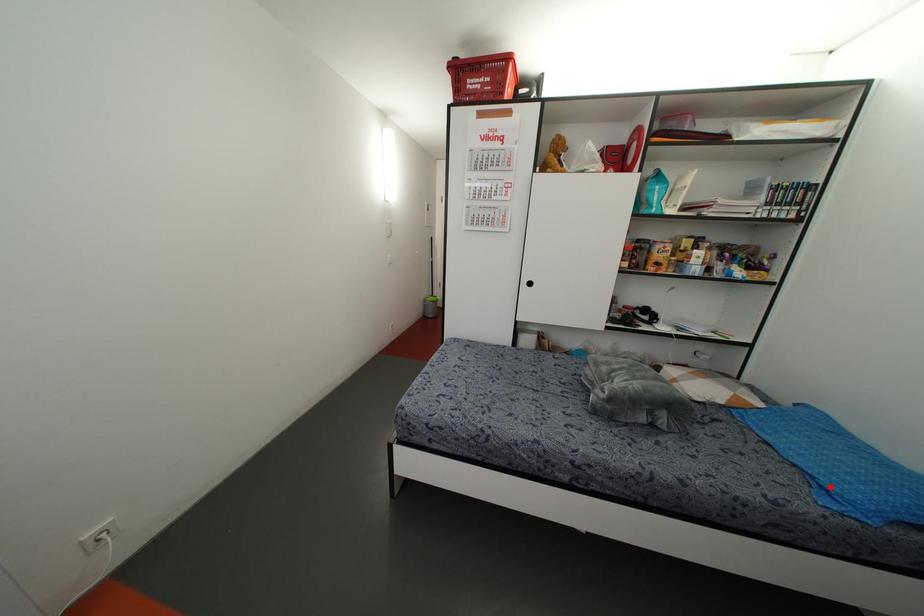
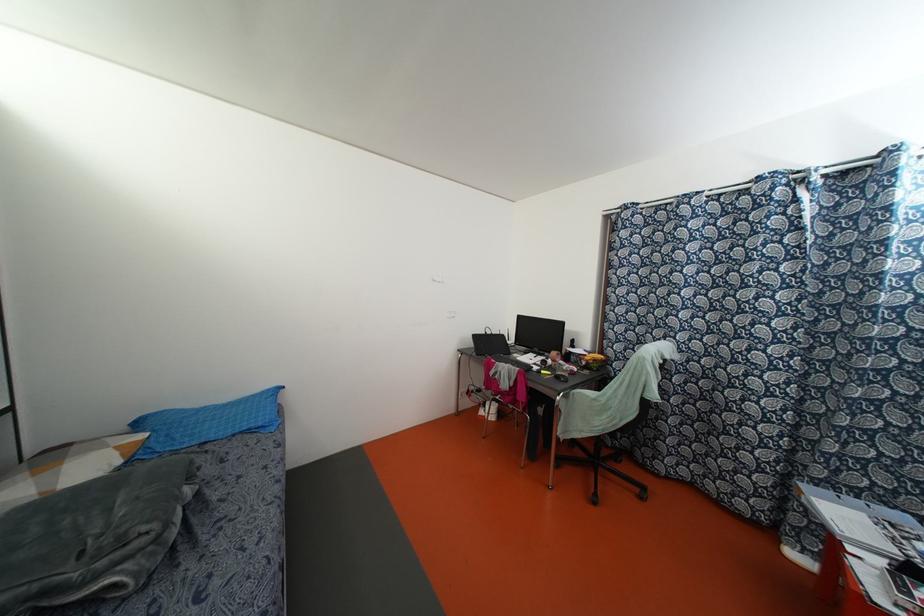
Locate, in the second image, the point that corresponds to the highlighted location in the first image.

(259, 424)